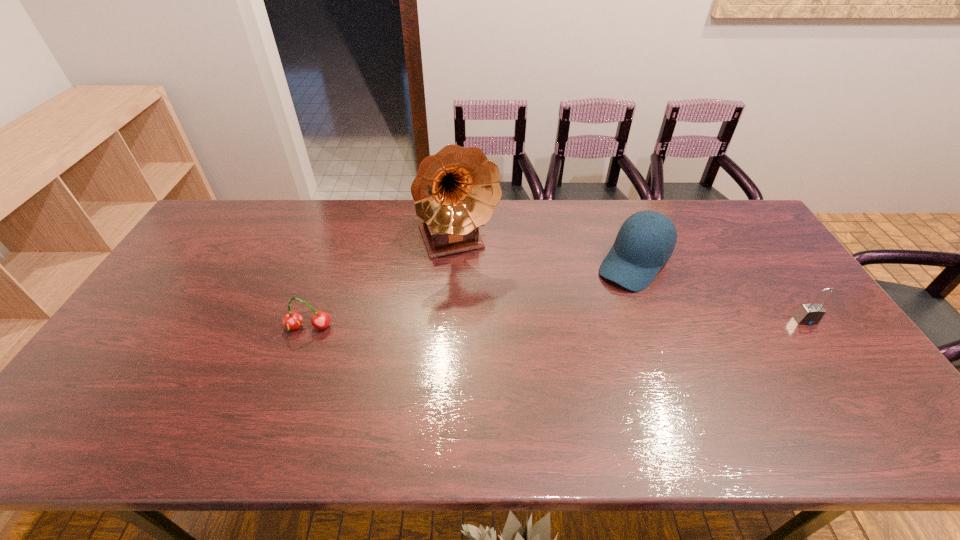
You are a GUI agent. You are given a task and a screenshot of the screen. Output one action in this format:
    pyautogui.click(x=<x>, y=<y>)
    Task: Click on the free point located on the front-facing side of the second object from right to left
    
    Given the screenshot: What is the action you would take?
    pyautogui.click(x=571, y=339)

Image resolution: width=960 pixels, height=540 pixels. What are the coordinates of `free space located on the horn of the phonograph_record` in the screenshot? It's located at (479, 294).

Identify the location of vacant space situated on the horn of the phonograph_record. The width and height of the screenshot is (960, 540). (476, 287).

Locate an element on the screen. free spot located on the horn of the phonograph_record is located at coordinates (500, 343).

Locate an element on the screen. This screenshot has height=540, width=960. baseball cap that is at the far edge is located at coordinates (646, 240).

Where is `phonograph_record positioned at the far edge`? Image resolution: width=960 pixels, height=540 pixels. phonograph_record positioned at the far edge is located at coordinates (455, 192).

This screenshot has height=540, width=960. Identify the location of object situated at the right edge. (808, 314).

Find the location of a particular element. The image size is (960, 540). free space at the far edge of the desktop is located at coordinates (700, 240).

Where is `free space at the near edge`? Image resolution: width=960 pixels, height=540 pixels. free space at the near edge is located at coordinates (730, 383).

In order to click on vacant point at the left edge in this screenshot , I will do `click(108, 369)`.